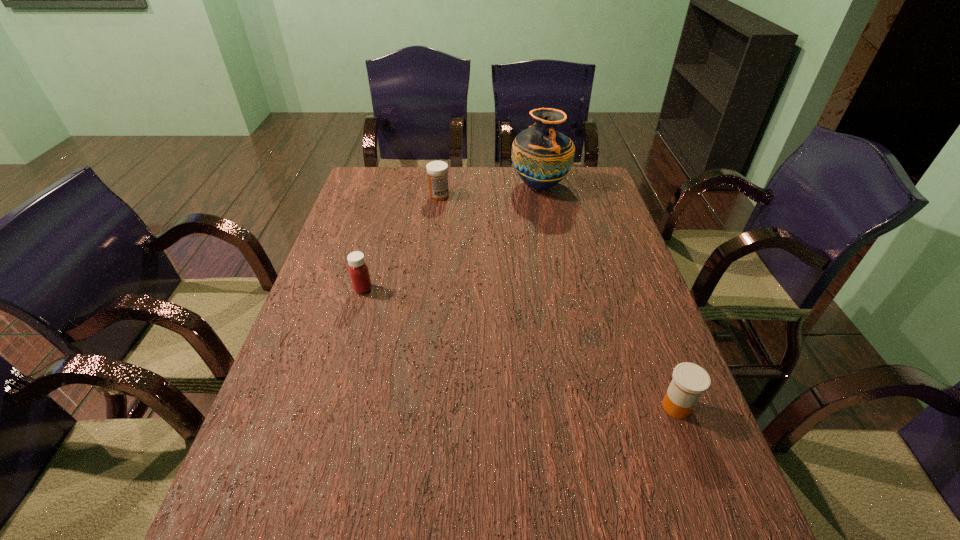
In the image, there is a desktop. Where is `free region at the far edge`? The width and height of the screenshot is (960, 540). free region at the far edge is located at coordinates (475, 174).

In order to click on vacant region at the left edge in this screenshot , I will do `click(373, 208)`.

In order to click on free space at the right edge of the desktop in this screenshot , I will do `click(612, 273)`.

Find the location of a particular element. The width and height of the screenshot is (960, 540). free space at the far right corner is located at coordinates point(580,173).

The height and width of the screenshot is (540, 960). I want to click on empty space between the leftmost medicine and the nearest medicine, so click(519, 348).

Locate an element on the screen. free spot between the rightmost medicine and the second farthest medicine is located at coordinates (519, 348).

At what (x,y) coordinates should I click in order to perform the action: click on vacant area that lies between the second object from right to left and the leftmost medicine. Please return your answer as a coordinate pair (x, y). This screenshot has height=540, width=960. Looking at the image, I should click on (451, 238).

Image resolution: width=960 pixels, height=540 pixels. I want to click on vacant area between the second nearest medicine and the tallest object, so click(x=451, y=238).

At what (x,y) coordinates should I click in order to perform the action: click on blank region between the second object from left to right and the nearest object. Please return your answer as a coordinate pair (x, y). The image size is (960, 540). Looking at the image, I should click on click(558, 301).

What are the coordinates of `free space between the second object from right to left and the leftmost medicine` in the screenshot? It's located at 451,238.